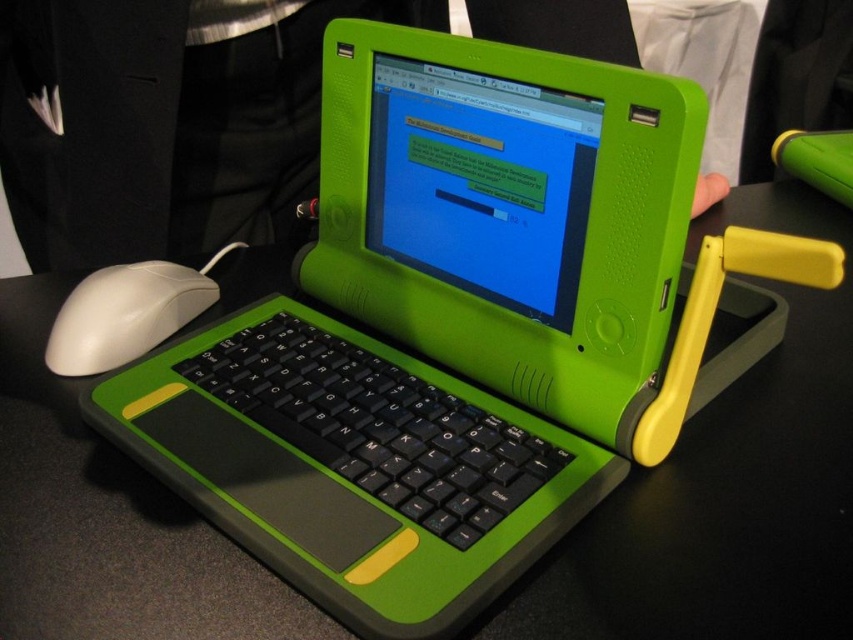
Is black matte table at center further to the viewer compared to white matte mouse at left?

No.

Does black matte table at center have a lesser width compared to white matte mouse at left?

Incorrect, black matte table at center's width is not less than white matte mouse at left's.

Is point (807, 506) positioned in front of point (108, 280)?

That is True.

The image size is (853, 640). In order to click on black matte table at center in this screenshot , I will do `click(726, 488)`.

Who is higher up, black rubberized keyboard at center or white matte mouse at left?

white matte mouse at left is above.

Can you confirm if black rubberized keyboard at center is shorter than white matte mouse at left?

No.

Who is more distant from viewer, [258,403] or [82,280]?

Point [82,280]

The width and height of the screenshot is (853, 640). I want to click on black rubberized keyboard at center, so click(x=378, y=426).

Which is more to the left, black matte table at center or black rubberized keyboard at center?

Positioned to the left is black rubberized keyboard at center.

Is black matte table at center behind black rubberized keyboard at center?

No, it is in front of black rubberized keyboard at center.

Identify the location of black matte table at center. click(x=726, y=488).